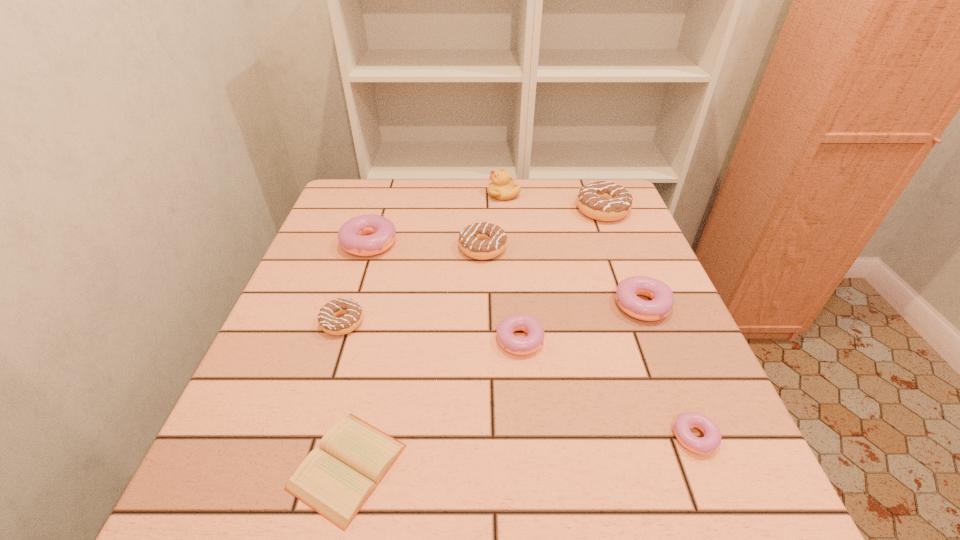
At what (x,y) coordinates should I click in order to perform the action: click on the tallest object. Please return your answer as a coordinate pair (x, y). Image resolution: width=960 pixels, height=540 pixels. Looking at the image, I should click on (502, 188).

Identify the location of yellow duckling. This screenshot has width=960, height=540. (502, 188).

Where is `the rightmost chocolate doughnut`? The image size is (960, 540). the rightmost chocolate doughnut is located at coordinates (600, 200).

Where is `the biggest chocolate doughnut`? Image resolution: width=960 pixels, height=540 pixels. the biggest chocolate doughnut is located at coordinates (600, 200).

Find the location of a particular element. This screenshot has width=960, height=540. the farthest purple doughnut is located at coordinates (353, 238).

The image size is (960, 540). What are the coordinates of `the leftmost purple doughnut` in the screenshot? It's located at (353, 238).

Locate an element on the screen. the second nearest chocolate doughnut is located at coordinates (482, 241).

Where is `the second biggest chocolate doughnut`? The height and width of the screenshot is (540, 960). the second biggest chocolate doughnut is located at coordinates (482, 241).

The height and width of the screenshot is (540, 960). I want to click on the third smallest purple doughnut, so click(627, 290).

Find the location of a particular element. Image resolution: width=960 pixels, height=540 pixels. the smallest chocolate doughnut is located at coordinates (353, 314).